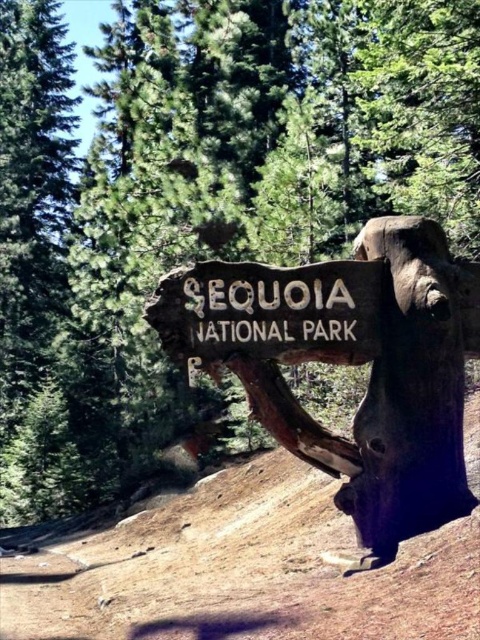
You are a hiker who wants to follow the brown dirt track at lower left to reach the Sequoia National Park sign. According to the scene, is the weathered wood sign at center located above or below the dirt track?

The brown dirt track at lower left is below the weathered wood sign at center, so the sign is located above the dirt track.